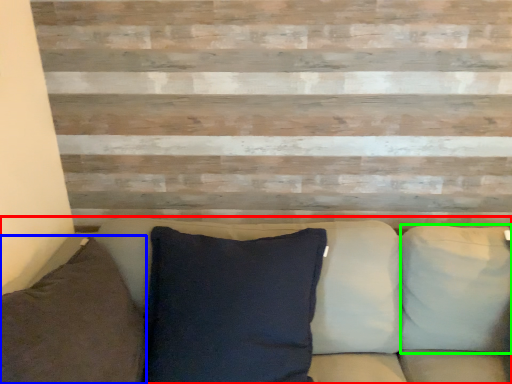
Question: Which object is positioned closest to studio couch (highlighted by a red box)? Select from pillow (highlighted by a blue box) and pillow (highlighted by a green box).

Choices:
 (A) pillow
 (B) pillow

Answer: (B)